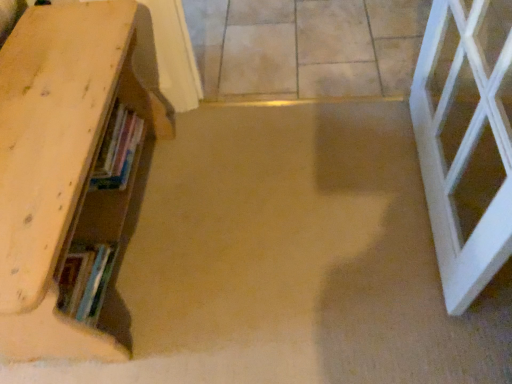
In order to click on beige tile floor at center in this screenshot , I will do `click(305, 47)`.

The height and width of the screenshot is (384, 512). What do you see at coordinates (68, 174) in the screenshot? I see `wooden bookshelf at left` at bounding box center [68, 174].

The height and width of the screenshot is (384, 512). What are the coordinates of `hardcover books at left` in the screenshot? It's located at (118, 150).

Is beige tile floor at center facing away from hardcover books at left?

No, beige tile floor at center is not facing the opposite direction of hardcover books at left.

Which of these two, beige tile floor at center or hardcover books at left, is smaller?

hardcover books at left is smaller.

Would you say beige tile floor at center is outside hardcover books at left?

Yes, beige tile floor at center is outside of hardcover books at left.

Which of these two, beige tile floor at center or hardcover books at left, stands taller?

hardcover books at left.

Could you tell me if beige tile floor at center is facing wooden bookshelf at left?

No, beige tile floor at center is not aimed at wooden bookshelf at left.

In the scene shown: From a real-world perspective, is beige tile floor at center over wooden bookshelf at left?

No, from a real-world perspective, beige tile floor at center is not over wooden bookshelf at left

Choose the correct answer: Is beige tile floor at center inside wooden bookshelf at left or outside it?

beige tile floor at center cannot be found inside wooden bookshelf at left.

Consider the image. Can you confirm if beige tile floor at center is bigger than wooden bookshelf at left?

No, beige tile floor at center is not bigger than wooden bookshelf at left.

Between wooden bookshelf at left and hardcover books at left, which one appears on the right side from the viewer's perspective?

hardcover books at left.

Is wooden bookshelf at left with hardcover books at left?

No.

Considering the points (26, 134) and (100, 165), which point is in front, point (26, 134) or point (100, 165)?

The point (26, 134) is more forward.

From the image's perspective, who appears lower, wooden bookshelf at left or hardcover books at left?

wooden bookshelf at left appears lower in the image.

Is hardcover books at left shorter than beige tile floor at center?

No.

Is hardcover books at left positioned behind beige tile floor at center?

No, hardcover books at left is closer to the camera.

Is hardcover books at left not close to beige tile floor at center?

No, there isn't a large distance between hardcover books at left and beige tile floor at center.

Which of these two, hardcover books at left or beige tile floor at center, is bigger?

beige tile floor at center.

Is hardcover books at left positioned beyond the bounds of wooden bookshelf at left?

No, hardcover books at left is inside wooden bookshelf at left's boundary.

Does hardcover books at left have a lesser width compared to wooden bookshelf at left?

Correct, the width of hardcover books at left is less than that of wooden bookshelf at left.

Which object is closer to the camera taking this photo, hardcover books at left or wooden bookshelf at left?

wooden bookshelf at left.

Is hardcover books at left oriented towards wooden bookshelf at left?

Yes.

From a real-world perspective, is wooden bookshelf at left positioned above or below beige tile floor at center?

From a real-world perspective, wooden bookshelf at left is physically above beige tile floor at center.

Considering the sizes of objects wooden bookshelf at left and beige tile floor at center in the image provided, who is bigger, wooden bookshelf at left or beige tile floor at center?

Bigger between the two is wooden bookshelf at left.

Between wooden bookshelf at left and beige tile floor at center, which one is positioned behind?

Positioned behind is beige tile floor at center.

Which is more to the right, wooden bookshelf at left or beige tile floor at center?

beige tile floor at center.

In the image, there is a beige tile floor at center. Identify the location of book below it (from the image's perspective). This screenshot has width=512, height=384. (118, 150).

Identify the location of shelf above the beige tile floor at center (from a real-world perspective). (68, 174).

When comparing their distances from beige tile floor at center, does wooden bookshelf at left or hardcover books at left seem closer?

wooden bookshelf at left.

Looking at the image, which one is located further to wooden bookshelf at left, hardcover books at left or beige tile floor at center?

beige tile floor at center.

Which object lies further to the anchor point hardcover books at left, wooden bookshelf at left or beige tile floor at center?

beige tile floor at center is further to hardcover books at left.

Which object lies nearer to the anchor point wooden bookshelf at left, beige tile floor at center or hardcover books at left?

Based on the image, hardcover books at left appears to be nearer to wooden bookshelf at left.

When comparing their distances from beige tile floor at center, does hardcover books at left or wooden bookshelf at left seem closer?

wooden bookshelf at left.

Looking at the image, which one is located further to hardcover books at left, beige tile floor at center or wooden bookshelf at left?

beige tile floor at center is further to hardcover books at left.

Identify the location of book between wooden bookshelf at left and beige tile floor at center along the z-axis. The image size is (512, 384). (118, 150).